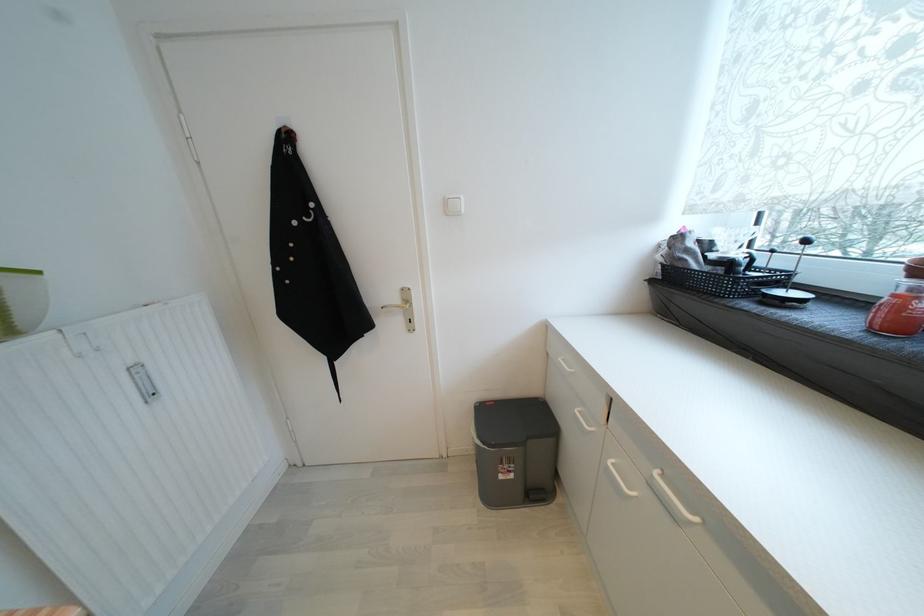
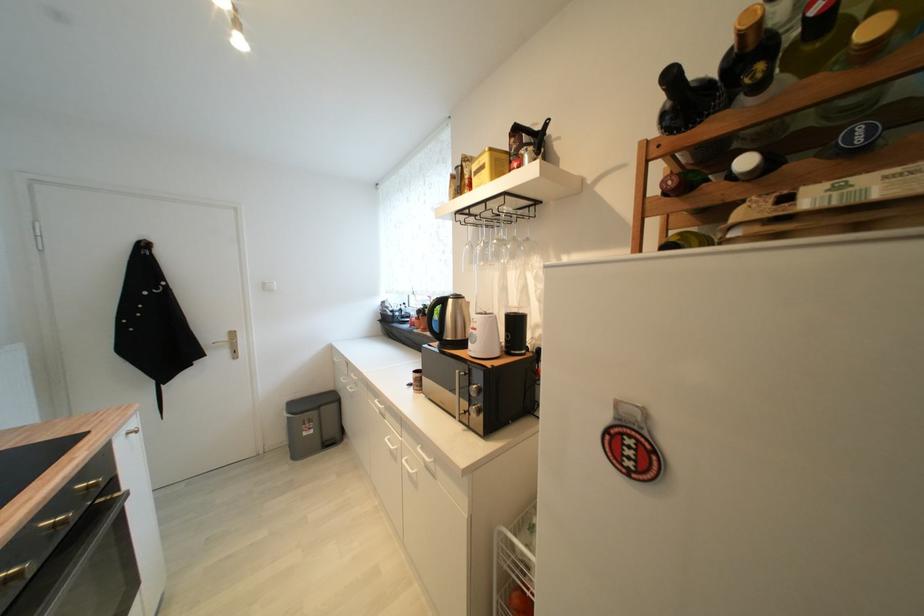
Locate, in the second image, the point that corresponds to the point at 505,479 in the first image.

(310, 436)